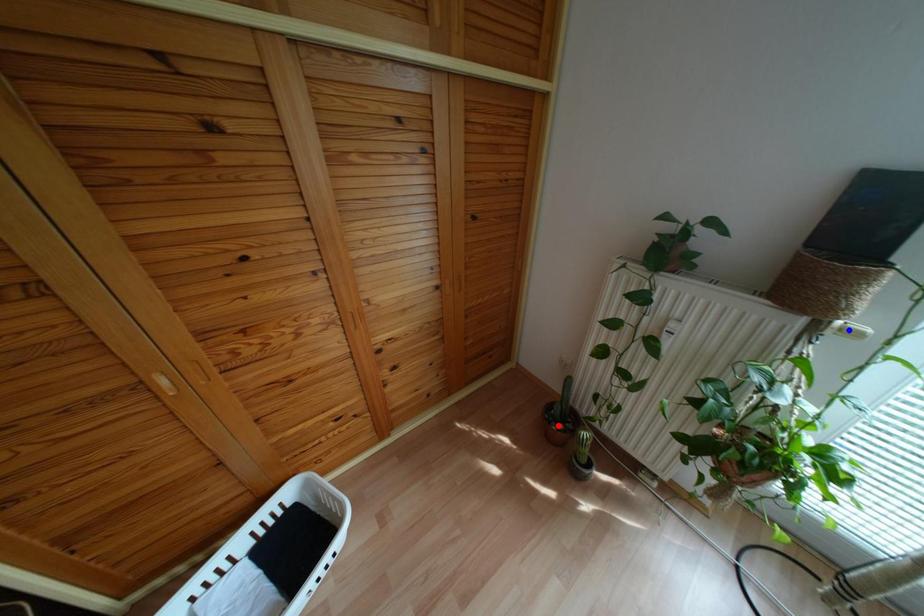
Question: Which of the two points in the image is closer to the camera?

Choices:
 (A) Blue point is closer.
 (B) Red point is closer.

Answer: (A)